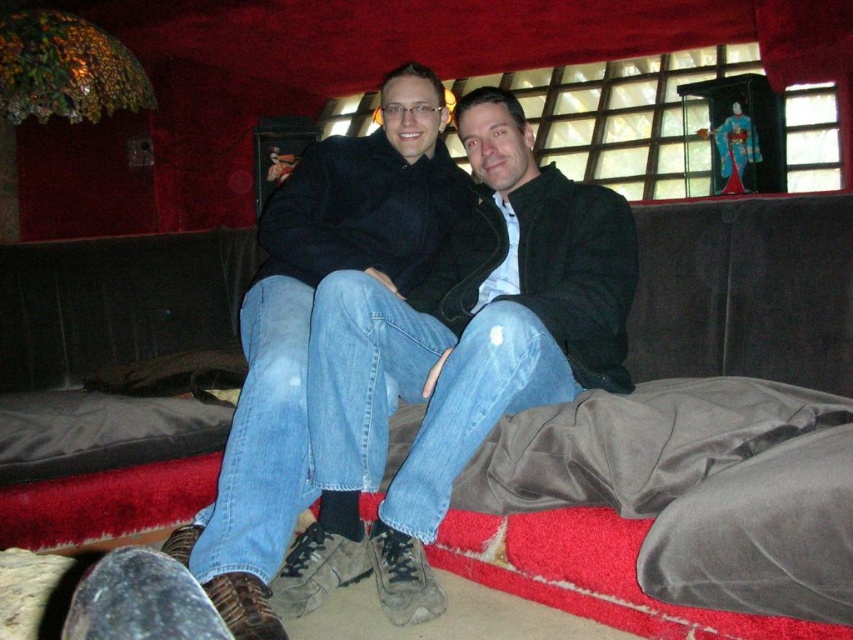
Question: Can you confirm if velvet dark brown couch at center is positioned above jeans at center?

Choices:
 (A) yes
 (B) no

Answer: (A)

Question: Among these objects, which one is farthest from the camera?

Choices:
 (A) velvet dark brown couch at center
 (B) jeans at center

Answer: (A)

Question: Where is velvet dark brown couch at center located in relation to jeans at center in the image?

Choices:
 (A) right
 (B) left

Answer: (B)

Question: Which point is farther to the camera?

Choices:
 (A) (553, 298)
 (B) (50, 536)

Answer: (B)

Question: Does velvet dark brown couch at center have a larger size compared to jeans at center?

Choices:
 (A) yes
 (B) no

Answer: (B)